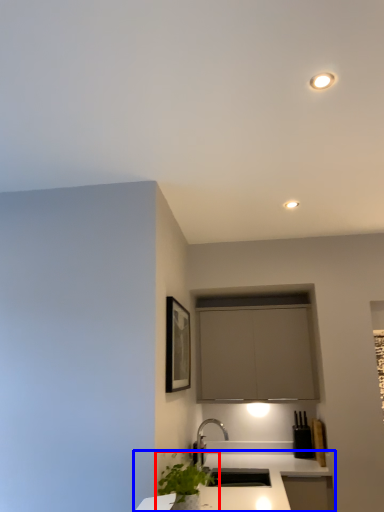
Question: Which of the following is the closest to the observer, houseplant (highlighted by a red box) or countertop (highlighted by a blue box)?

Choices:
 (A) houseplant
 (B) countertop

Answer: (B)